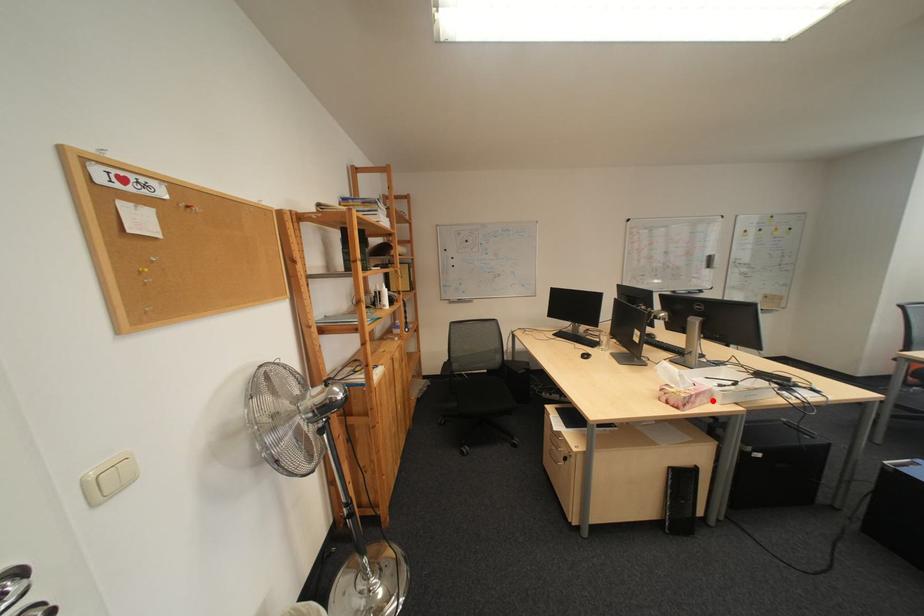
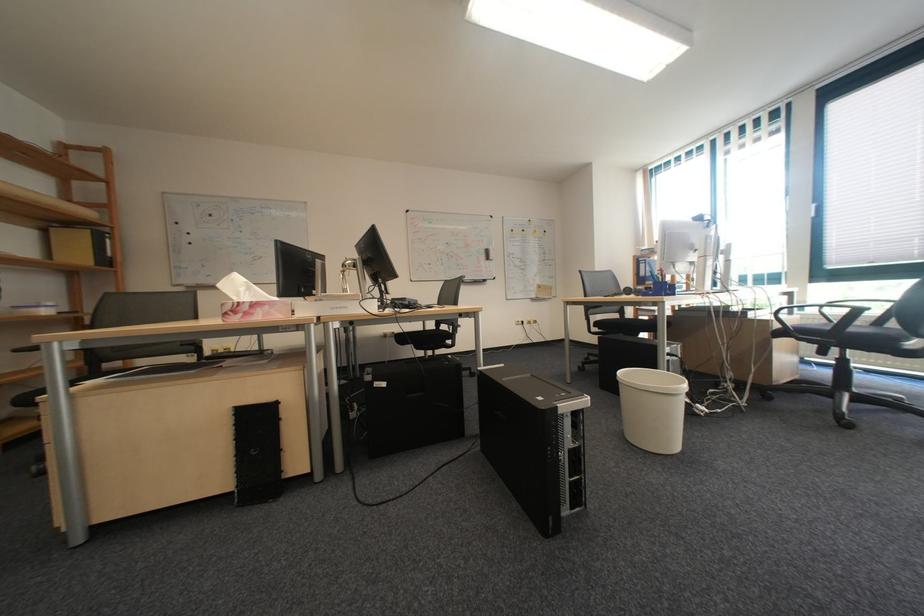
The point at the highlighted location is marked in the first image. Where is the corresponding point in the second image?

(273, 312)